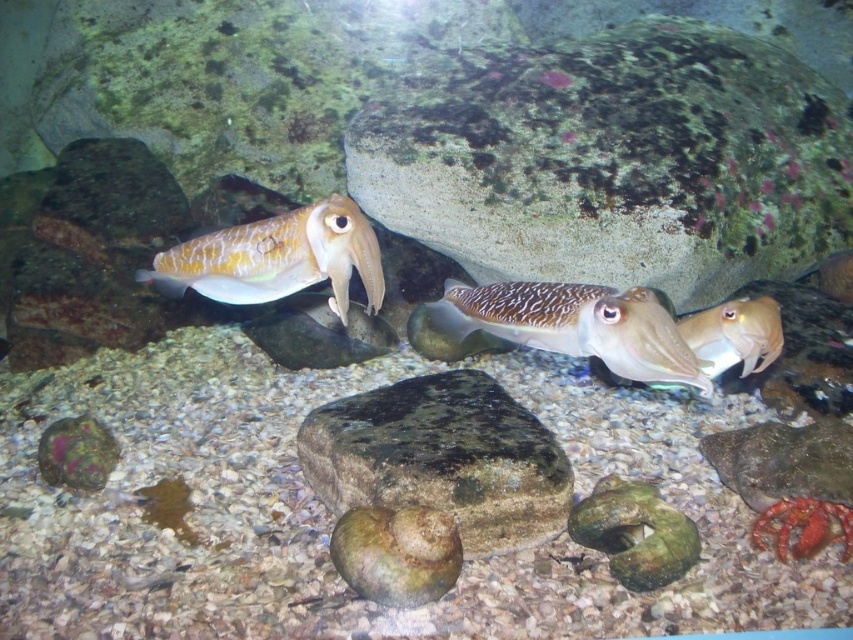
Question: Considering the real-world distances, which object is farthest from the speckled skin squid at center?

Choices:
 (A) smooth brown squid at center
 (B) smooth orange squid at lower right
 (C) shiny brown squid at center

Answer: (B)

Question: Does speckled skin squid at center appear under smooth brown squid at center?

Choices:
 (A) yes
 (B) no

Answer: (B)

Question: Which point is farther to the camera?

Choices:
 (A) (463, 330)
 (B) (302, 284)
 (C) (766, 509)
 (D) (606, 368)

Answer: (D)

Question: Is shiny brown squid at center above smooth brown squid at center?

Choices:
 (A) no
 (B) yes

Answer: (B)

Question: Which of the following is the closest to the observer?

Choices:
 (A) (804, 531)
 (B) (303, 268)

Answer: (B)

Question: Does shiny brown squid at center appear over smooth brown squid at center?

Choices:
 (A) yes
 (B) no

Answer: (A)